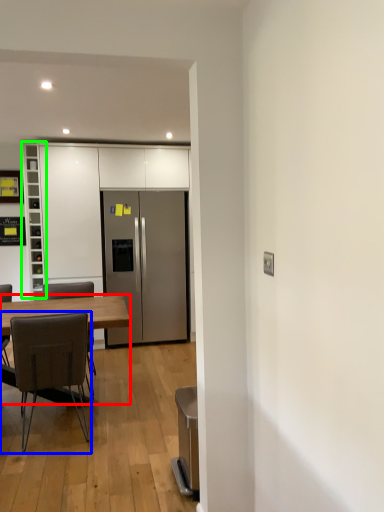
Question: Which is farther away from desk (highlighted by a red box)? chair (highlighted by a blue box) or cabinetry (highlighted by a green box)?

Choices:
 (A) chair
 (B) cabinetry

Answer: (B)